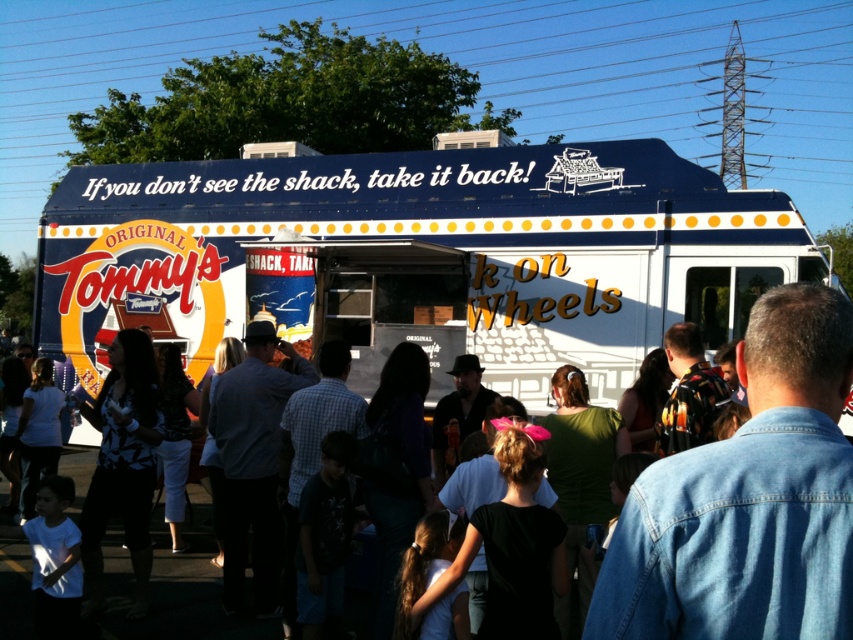
Question: From the image, what is the correct spatial relationship of blue painted truck at center in relation to denim jacket at center?

Choices:
 (A) left
 (B) right

Answer: (B)

Question: Which of the following is the closest to the observer?

Choices:
 (A) denim jacket at center
 (B) blue painted truck at center

Answer: (A)

Question: Is blue painted truck at center to the left of denim jacket at center from the viewer's perspective?

Choices:
 (A) yes
 (B) no

Answer: (B)

Question: Which point is closer to the camera?

Choices:
 (A) (374, 324)
 (B) (22, 634)

Answer: (B)

Question: Is blue painted truck at center bigger than denim jacket at center?

Choices:
 (A) yes
 (B) no

Answer: (B)